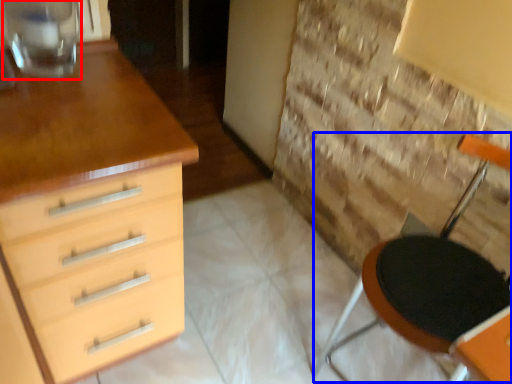
Question: Which of the following is the closest to the observer, glass vase (highlighted by a red box) or armchair (highlighted by a blue box)?

Choices:
 (A) glass vase
 (B) armchair

Answer: (B)